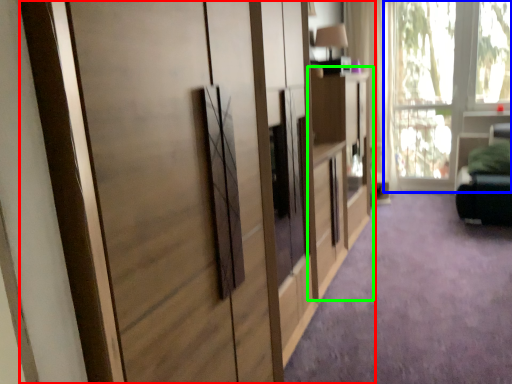
Question: Which is farther away from cupboard (highlighted by a red box)? window (highlighted by a blue box) or dresser (highlighted by a green box)?

Choices:
 (A) window
 (B) dresser

Answer: (A)